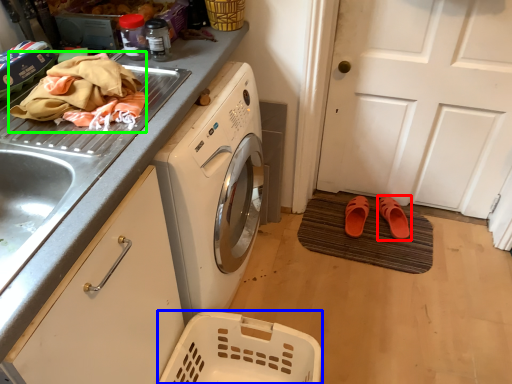
Question: Which object is the closest to the footwear (highlighted by a red box)? Choose among these: basket (highlighted by a blue box) or material (highlighted by a green box).

Choices:
 (A) basket
 (B) material

Answer: (A)